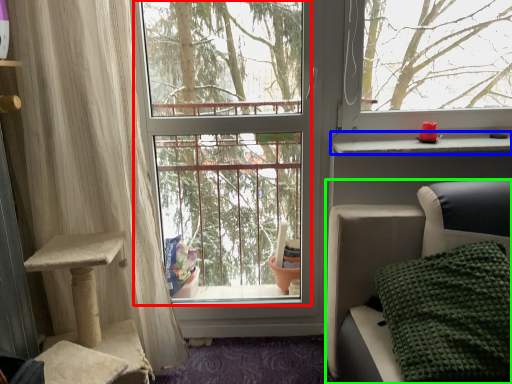
Question: Which object is positioned farthest from window screen (highlighted by a red box)? Select from window sill (highlighted by a blue box) and furniture (highlighted by a green box).

Choices:
 (A) window sill
 (B) furniture

Answer: (A)